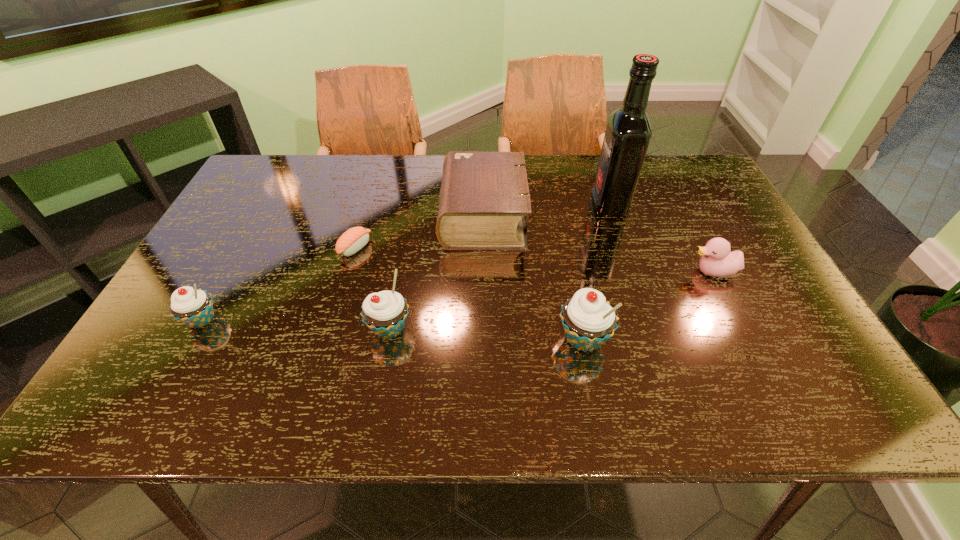
The cupcakes are evenly distributed in the image. To maintain this, where would you place another cupcake on the right? Please point to a free space. Please provide its 2D coordinates. Your answer should be formatted as a tuple, i.e. [(x, y)], where the tuple contains the x and y coordinates of a point satisfying the conditions above.

[(785, 349)]